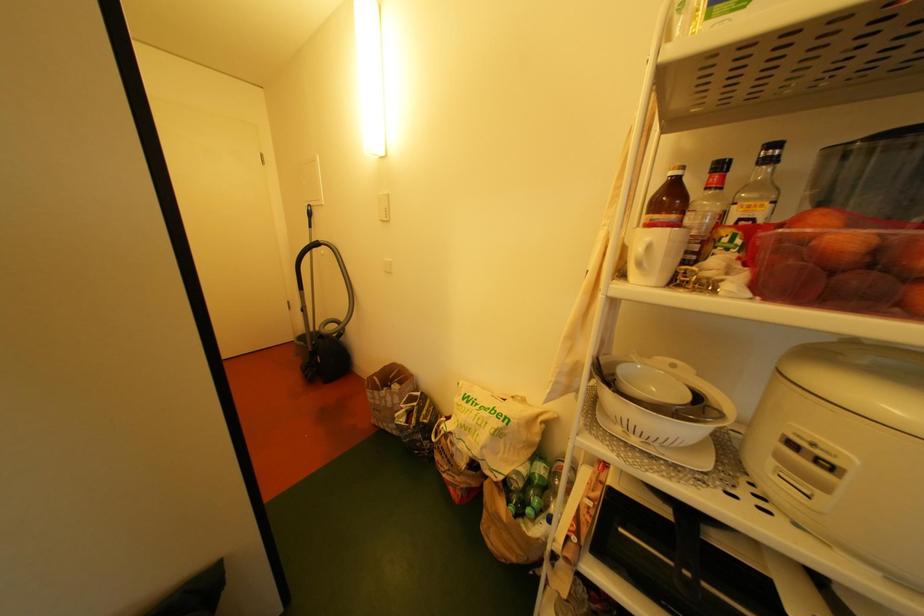
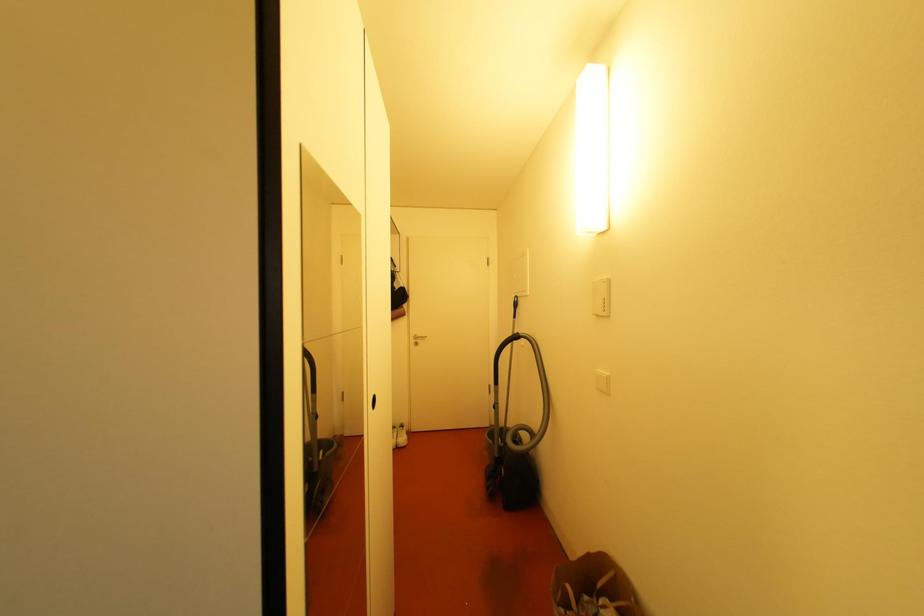
Question: The camera is either moving clockwise (left) or counter-clockwise (right) around the object. The first image is from the beginning of the video and the second image is from the end. Is the camera moving left or right when shooting the video?

Choices:
 (A) Left
 (B) Right

Answer: (B)